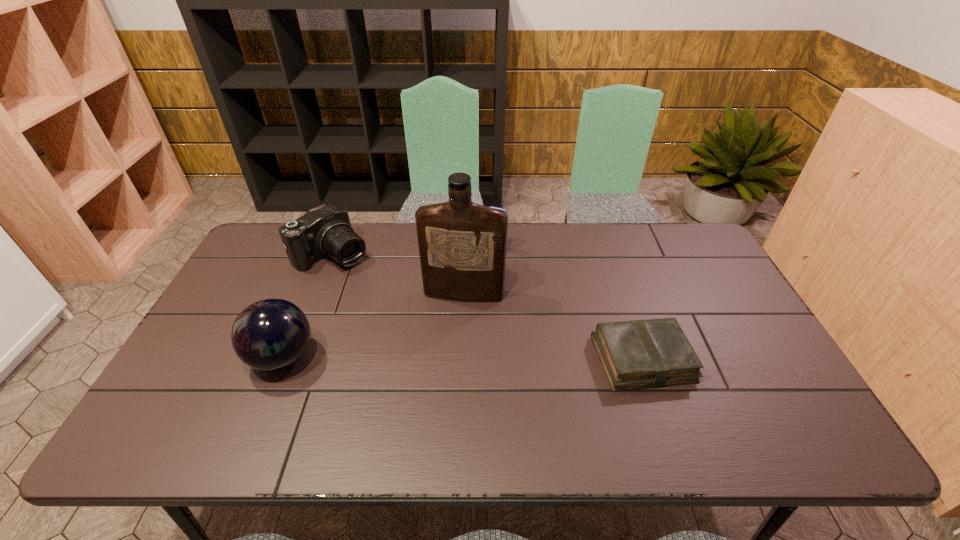
Locate an element on the screen. This screenshot has height=540, width=960. vacant area at the right edge of the desktop is located at coordinates (746, 364).

Image resolution: width=960 pixels, height=540 pixels. What are the coordinates of `vacant area at the far left corner` in the screenshot? It's located at (276, 237).

Find the location of `vacant space at the far right corner of the desktop`. vacant space at the far right corner of the desktop is located at coordinates pos(686,225).

Identify the location of empty space between the third farthest object and the camera. (398, 274).

You are a GUI agent. You are given a task and a screenshot of the screen. Output one action in this format:
    pyautogui.click(x=<x>, y=<y>)
    Task: Click on the vacant region between the book and the camera
    Image resolution: width=960 pixels, height=540 pixels.
    Given the screenshot: What is the action you would take?
    pyautogui.click(x=488, y=307)

What are the coordinates of `free space between the cellular telephone and the bowling ball` in the screenshot? It's located at (389, 304).

The image size is (960, 540). I want to click on free space between the cellular telephone and the bowling ball, so click(389, 304).

What are the coordinates of `vacant region between the cellular telephone and the camera` in the screenshot? It's located at (414, 252).

Find the location of a particular element. This screenshot has width=960, height=540. free spot between the third farthest object and the camera is located at coordinates (398, 274).

You are a GUI agent. You are given a task and a screenshot of the screen. Output one action in this format:
    pyautogui.click(x=<x>, y=<y>)
    Task: Click on the vacant space that's between the bowling ball and the cellular telephone
    
    Given the screenshot: What is the action you would take?
    pyautogui.click(x=389, y=304)